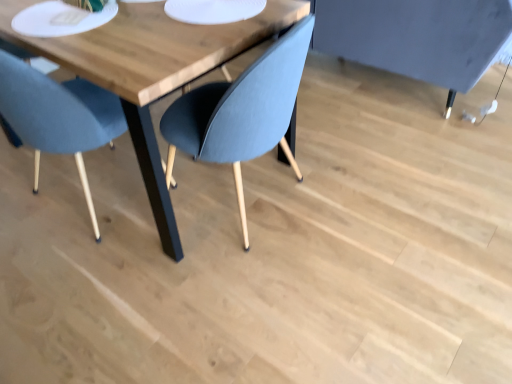
Question: Can you confirm if matte blue chair at left is taller than wooden table at center?

Choices:
 (A) yes
 (B) no

Answer: (A)

Question: Would you consider matte blue chair at left to be distant from wooden table at center?

Choices:
 (A) no
 (B) yes

Answer: (A)

Question: Does matte blue chair at left have a larger size compared to wooden table at center?

Choices:
 (A) yes
 (B) no

Answer: (B)

Question: Is matte blue chair at left to the right of wooden table at center from the viewer's perspective?

Choices:
 (A) no
 (B) yes

Answer: (A)

Question: Does matte blue chair at left contain wooden table at center?

Choices:
 (A) yes
 (B) no

Answer: (B)

Question: From the image's perspective, is matte blue chair at left positioned above or below white matte paper plate at upper center?

Choices:
 (A) below
 (B) above

Answer: (A)

Question: From their relative heights in the image, would you say matte blue chair at left is taller or shorter than white matte paper plate at upper center?

Choices:
 (A) short
 (B) tall

Answer: (B)

Question: From a real-world perspective, is matte blue chair at left physically located above or below white matte paper plate at upper center?

Choices:
 (A) below
 (B) above

Answer: (A)

Question: In terms of size, does matte blue chair at left appear bigger or smaller than white matte paper plate at upper center?

Choices:
 (A) big
 (B) small

Answer: (A)

Question: Does point (169, 244) appear closer or farther from the camera than point (170, 11)?

Choices:
 (A) closer
 (B) farther

Answer: (B)

Question: From the image's perspective, is wooden table at center above or below white matte paper plate at upper center?

Choices:
 (A) below
 (B) above

Answer: (A)

Question: Is wooden table at center wider or thinner than white matte paper plate at upper center?

Choices:
 (A) thin
 (B) wide

Answer: (B)

Question: Is wooden table at center spatially inside white matte paper plate at upper center, or outside of it?

Choices:
 (A) inside
 (B) outside

Answer: (B)

Question: Considering the positions of white matte paper plate at upper center and wooden table at center in the image, is white matte paper plate at upper center wider or thinner than wooden table at center?

Choices:
 (A) wide
 (B) thin

Answer: (B)

Question: In terms of size, does white matte paper plate at upper center appear bigger or smaller than wooden table at center?

Choices:
 (A) big
 (B) small

Answer: (B)